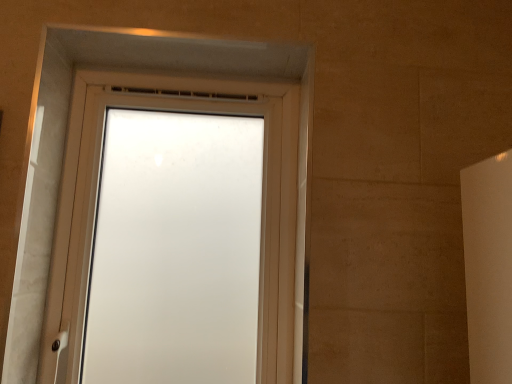
The width and height of the screenshot is (512, 384). Describe the element at coordinates (95, 204) in the screenshot. I see `frosted glass door at upper center` at that location.

Find the location of `frosted glass door at upper center`. frosted glass door at upper center is located at coordinates (95, 204).

Image resolution: width=512 pixels, height=384 pixels. Identify the location of frosted glass door at upper center. (95, 204).